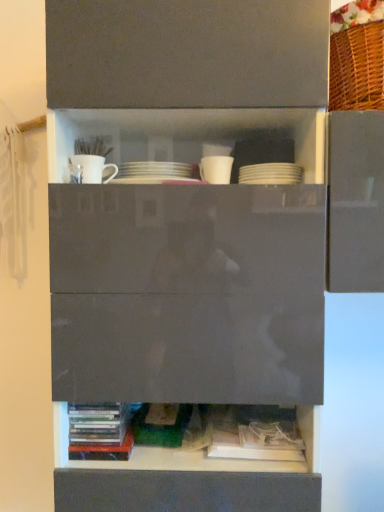
What do you see at coordinates (270, 174) in the screenshot?
I see `white matte plates at upper center, which appears as the 1th tableware when viewed from the right` at bounding box center [270, 174].

What is the approximate height of white matte mug at upper center, positioned as the 2th tableware in left-to-right order?

3.55 inches.

I want to click on white matte mug at upper left, which appears as the third tableware when viewed from the right, so click(x=91, y=169).

Between white paper book at lower center, which is counted as the second book, starting from the left, and white matte plates at upper center, positioned as the third tableware in left-to-right order, which one has larger size?

white paper book at lower center, which is counted as the second book, starting from the left, is bigger.

Which book is the 1st one when counting from the left side of the white matte plates at upper center, positioned as the third tableware in left-to-right order? Please provide its 2D coordinates.

[(256, 434)]

Is white paper book at lower center, which is counted as the second book, starting from the left, with white matte plates at upper center, which appears as the 1th tableware when viewed from the right?

No, white paper book at lower center, which is counted as the second book, starting from the left, is not beside white matte plates at upper center, which appears as the 1th tableware when viewed from the right.

From the image's perspective, between white matte mug at upper center, positioned as the 2th tableware in left-to-right order, and white matte plates at upper center, which appears as the 1th tableware when viewed from the right, which one is located above?

white matte mug at upper center, positioned as the 2th tableware in left-to-right order.

Can you confirm if white matte mug at upper center, positioned as the 2th tableware in left-to-right order, is positioned to the right of white matte plates at upper center, which appears as the 1th tableware when viewed from the right?

In fact, white matte mug at upper center, positioned as the 2th tableware in left-to-right order, is to the left of white matte plates at upper center, which appears as the 1th tableware when viewed from the right.

The width and height of the screenshot is (384, 512). In order to click on the 1st tableware to the left of the white matte plates at upper center, positioned as the third tableware in left-to-right order, starting your count from the anchor in this screenshot , I will do `click(216, 169)`.

Do you think white matte mug at upper center, acting as the second tableware starting from the right, is within white matte plates at upper center, which appears as the 1th tableware when viewed from the right, or outside of it?

white matte mug at upper center, acting as the second tableware starting from the right, is spatially situated outside white matte plates at upper center, which appears as the 1th tableware when viewed from the right.

Is white matte mug at upper left, marked as the 1th tableware in a left-to-right arrangement, bigger or smaller than white matte mug at upper center, positioned as the 2th tableware in left-to-right order?

Clearly, white matte mug at upper left, marked as the 1th tableware in a left-to-right arrangement, is larger in size than white matte mug at upper center, positioned as the 2th tableware in left-to-right order.

Between white matte mug at upper left, marked as the 1th tableware in a left-to-right arrangement, and white matte mug at upper center, acting as the second tableware starting from the right, which one has less height?

white matte mug at upper left, marked as the 1th tableware in a left-to-right arrangement, is shorter.

Is white matte mug at upper left, marked as the 1th tableware in a left-to-right arrangement, outside of white matte mug at upper center, positioned as the 2th tableware in left-to-right order?

Yes, white matte mug at upper left, marked as the 1th tableware in a left-to-right arrangement, is outside of white matte mug at upper center, positioned as the 2th tableware in left-to-right order.

How different are the orientations of multicolored plastic books at lower left, placed as the 2th book when sorted from right to left, and white paper book at lower center, which is counted as the second book, starting from the left, in degrees?

There is a 0.000134-degree angle between the facing directions of multicolored plastic books at lower left, placed as the 2th book when sorted from right to left, and white paper book at lower center, which is counted as the second book, starting from the left.

Based on their positions, is multicolored plastic books at lower left, the first book from the left, located to the left or right of white paper book at lower center, the first book viewed from the right?

From the image, it's evident that multicolored plastic books at lower left, the first book from the left, is to the left of white paper book at lower center, the first book viewed from the right.

In terms of size, does multicolored plastic books at lower left, the first book from the left, appear bigger or smaller than white paper book at lower center, which is counted as the second book, starting from the left?

Clearly, multicolored plastic books at lower left, the first book from the left, is larger in size than white paper book at lower center, which is counted as the second book, starting from the left.

Does point (83, 454) appear closer or farther from the camera than point (237, 430)?

Point (83, 454).

Can you confirm if white paper book at lower center, which is counted as the second book, starting from the left, is positioned to the left of white matte mug at upper left, marked as the 1th tableware in a left-to-right arrangement?

In fact, white paper book at lower center, which is counted as the second book, starting from the left, is to the right of white matte mug at upper left, marked as the 1th tableware in a left-to-right arrangement.

Considering the sizes of objects white paper book at lower center, which is counted as the second book, starting from the left, and white matte mug at upper left, which appears as the third tableware when viewed from the right, in the image provided, who is wider, white paper book at lower center, which is counted as the second book, starting from the left, or white matte mug at upper left, which appears as the third tableware when viewed from the right,?

white paper book at lower center, which is counted as the second book, starting from the left, is wider.

Between white paper book at lower center, the first book viewed from the right, and white matte mug at upper left, which appears as the third tableware when viewed from the right, which one has smaller size?

Smaller between the two is white matte mug at upper left, which appears as the third tableware when viewed from the right.

Does white paper book at lower center, which is counted as the second book, starting from the left, turn towards white matte mug at upper left, which appears as the third tableware when viewed from the right?

No, white paper book at lower center, which is counted as the second book, starting from the left, is not aimed at white matte mug at upper left, which appears as the third tableware when viewed from the right.

The height and width of the screenshot is (512, 384). I want to click on the 3rd tableware above the multicolored plastic books at lower left, the first book from the left (from the image's perspective), so click(x=91, y=169).

Looking at this image, is multicolored plastic books at lower left, placed as the 2th book when sorted from right to left, inside or outside of white matte mug at upper left, marked as the 1th tableware in a left-to-right arrangement?

The correct answer is: outside.

Can you confirm if multicolored plastic books at lower left, the first book from the left, is taller than white matte mug at upper left, marked as the 1th tableware in a left-to-right arrangement?

Indeed, multicolored plastic books at lower left, the first book from the left, has a greater height compared to white matte mug at upper left, marked as the 1th tableware in a left-to-right arrangement.

Could you tell me if white matte plates at upper center, which appears as the 1th tableware when viewed from the right, is facing white matte mug at upper center, acting as the second tableware starting from the right?

No, white matte plates at upper center, which appears as the 1th tableware when viewed from the right, is not oriented towards white matte mug at upper center, acting as the second tableware starting from the right.

Does point (241, 170) lie behind point (209, 165)?

Yes.

From their relative heights in the image, would you say white matte plates at upper center, which appears as the 1th tableware when viewed from the right, is taller or shorter than white matte mug at upper center, acting as the second tableware starting from the right?

Considering their sizes, white matte plates at upper center, which appears as the 1th tableware when viewed from the right, has less height than white matte mug at upper center, acting as the second tableware starting from the right.

Between white matte plates at upper center, which appears as the 1th tableware when viewed from the right, and white matte mug at upper center, positioned as the 2th tableware in left-to-right order, which one appears on the right side from the viewer's perspective?

Positioned to the right is white matte plates at upper center, which appears as the 1th tableware when viewed from the right.

At what (x,y) coordinates should I click in order to perform the action: click on the 1st book to the left of the white matte plates at upper center, positioned as the third tableware in left-to-right order, counting from the anchor's position. Please return your answer as a coordinate pair (x, y). This screenshot has width=384, height=512. Looking at the image, I should click on (256, 434).

I want to click on the 1st tableware above the white matte plates at upper center, which appears as the 1th tableware when viewed from the right (from the image's perspective), so click(216, 169).

From the image, which object appears to be nearer to white paper book at lower center, which is counted as the second book, starting from the left, multicolored plastic books at lower left, placed as the 2th book when sorted from right to left, or white matte mug at upper center, acting as the second tableware starting from the right?

multicolored plastic books at lower left, placed as the 2th book when sorted from right to left.

Based on their spatial positions, is white matte mug at upper center, acting as the second tableware starting from the right, or white matte plates at upper center, positioned as the third tableware in left-to-right order, further from white matte mug at upper left, which appears as the third tableware when viewed from the right?

white matte plates at upper center, positioned as the third tableware in left-to-right order.

Estimate the real-world distances between objects in this image. Which object is further from white matte mug at upper center, acting as the second tableware starting from the right, white matte mug at upper left, marked as the 1th tableware in a left-to-right arrangement, or multicolored plastic books at lower left, the first book from the left?

multicolored plastic books at lower left, the first book from the left, is further to white matte mug at upper center, acting as the second tableware starting from the right.

Based on the photo, which object lies nearer to the anchor point multicolored plastic books at lower left, the first book from the left, white matte mug at upper center, acting as the second tableware starting from the right, or white matte plates at upper center, which appears as the 1th tableware when viewed from the right?

Based on the image, white matte mug at upper center, acting as the second tableware starting from the right, appears to be nearer to multicolored plastic books at lower left, the first book from the left.

Considering their positions, is multicolored plastic books at lower left, placed as the 2th book when sorted from right to left, positioned closer to white matte mug at upper center, acting as the second tableware starting from the right, than white paper book at lower center, which is counted as the second book, starting from the left?

multicolored plastic books at lower left, placed as the 2th book when sorted from right to left, is closer to white matte mug at upper center, acting as the second tableware starting from the right.

Looking at the image, which one is located further to white matte mug at upper center, positioned as the 2th tableware in left-to-right order, multicolored plastic books at lower left, placed as the 2th book when sorted from right to left, or white matte mug at upper left, marked as the 1th tableware in a left-to-right arrangement?

multicolored plastic books at lower left, placed as the 2th book when sorted from right to left, lies further to white matte mug at upper center, positioned as the 2th tableware in left-to-right order, than the other object.

Which object lies nearer to the anchor point white matte plates at upper center, positioned as the third tableware in left-to-right order, white paper book at lower center, which is counted as the second book, starting from the left, or white matte mug at upper center, acting as the second tableware starting from the right?

white matte mug at upper center, acting as the second tableware starting from the right, is closer to white matte plates at upper center, positioned as the third tableware in left-to-right order.

Looking at this image, when comparing their distances from white matte mug at upper left, which appears as the third tableware when viewed from the right, does multicolored plastic books at lower left, the first book from the left, or white paper book at lower center, the first book viewed from the right, seem closer?

multicolored plastic books at lower left, the first book from the left, is closer to white matte mug at upper left, which appears as the third tableware when viewed from the right.

You are a GUI agent. You are given a task and a screenshot of the screen. Output one action in this format:
    pyautogui.click(x=<x>, y=<y>)
    Task: Click on the tableware between white matte mug at upper center, acting as the second tableware starting from the right, and white paper book at lower center, the first book viewed from the right, in the up-down direction
    
    Given the screenshot: What is the action you would take?
    pyautogui.click(x=270, y=174)

What are the coordinates of `book between white matte mug at upper left, which appears as the third tableware when viewed from the right, and white paper book at lower center, which is counted as the second book, starting from the left, from top to bottom` in the screenshot? It's located at (100, 431).

Locate an element on the screen. This screenshot has width=384, height=512. tableware between white matte mug at upper left, which appears as the third tableware when viewed from the right, and white matte plates at upper center, positioned as the third tableware in left-to-right order, from left to right is located at coordinates (216, 169).

Find the location of a particular element. book between white matte mug at upper center, acting as the second tableware starting from the right, and white paper book at lower center, which is counted as the second book, starting from the left, in the up-down direction is located at coordinates (100, 431).